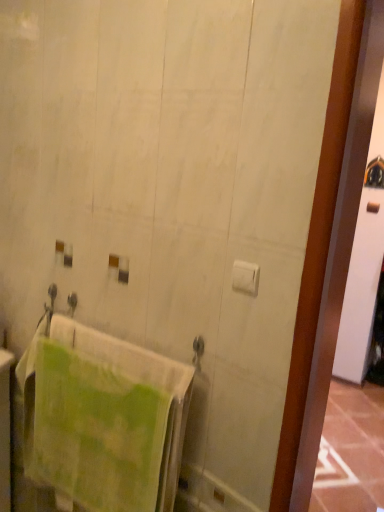
Question: Is white matte toilet paper at center-right not inside green textured towel at lower left?

Choices:
 (A) no
 (B) yes

Answer: (B)

Question: Can you confirm if white matte toilet paper at center-right is bigger than green textured towel at lower left?

Choices:
 (A) no
 (B) yes

Answer: (A)

Question: From a real-world perspective, is white matte toilet paper at center-right under green textured towel at lower left?

Choices:
 (A) yes
 (B) no

Answer: (B)

Question: Does white matte toilet paper at center-right appear on the left side of green textured towel at lower left?

Choices:
 (A) yes
 (B) no

Answer: (B)

Question: Can you confirm if white matte toilet paper at center-right is taller than green textured towel at lower left?

Choices:
 (A) no
 (B) yes

Answer: (A)

Question: Does white matte toilet paper at center-right have a smaller size compared to green textured towel at lower left?

Choices:
 (A) yes
 (B) no

Answer: (A)

Question: Is green textured towel at lower left far away from white matte toilet paper at center-right?

Choices:
 (A) yes
 (B) no

Answer: (B)

Question: From the image's perspective, is green textured towel at lower left over white matte toilet paper at center-right?

Choices:
 (A) yes
 (B) no

Answer: (B)

Question: Is green textured towel at lower left smaller than white matte toilet paper at center-right?

Choices:
 (A) yes
 (B) no

Answer: (B)

Question: Can you see green textured towel at lower left touching white matte toilet paper at center-right?

Choices:
 (A) yes
 (B) no

Answer: (B)

Question: Is green textured towel at lower left not within white matte toilet paper at center-right?

Choices:
 (A) yes
 (B) no

Answer: (A)

Question: From a real-world perspective, is green textured towel at lower left on white matte toilet paper at center-right?

Choices:
 (A) yes
 (B) no

Answer: (B)

Question: Is point (66, 371) positioned closer to the camera than point (254, 292)?

Choices:
 (A) farther
 (B) closer

Answer: (A)